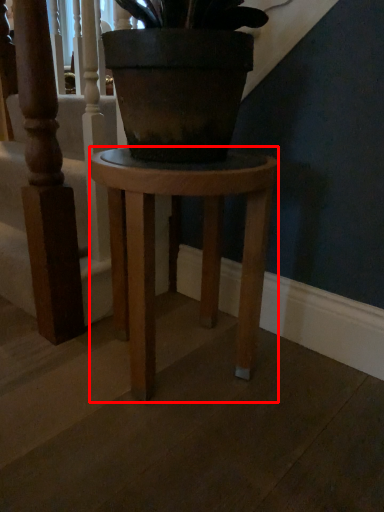
Question: From the image, what is the correct spatial relationship of stool (annotated by the red box) in relation to stairwell?

Choices:
 (A) right
 (B) left

Answer: (A)